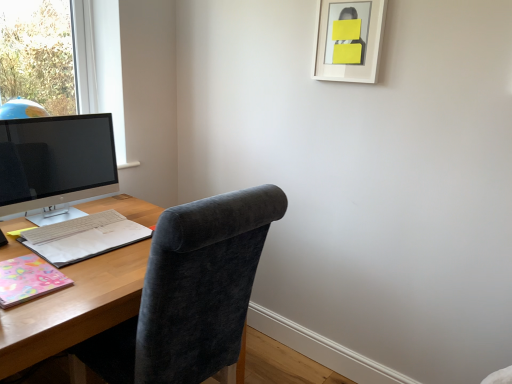
Measure the distance between point (260, 224) and camera.

The distance of point (260, 224) from camera is 1.27 meters.

Describe the element at coordinates (190, 292) in the screenshot. This screenshot has width=512, height=384. I see `dark gray fabric chair at center` at that location.

Locate an element on the screen. white matte keyboard at lower left is located at coordinates (71, 227).

What do you see at coordinates (74, 308) in the screenshot? This screenshot has width=512, height=384. I see `wooden desk at center` at bounding box center [74, 308].

How much space does multicolored paper notebook at left, acting as the first notebook starting from the back, occupy horizontally?

multicolored paper notebook at left, acting as the first notebook starting from the back, is 14.45 inches in width.

Image resolution: width=512 pixels, height=384 pixels. What do you see at coordinates (55, 161) in the screenshot?
I see `satin black monitor at left` at bounding box center [55, 161].

This screenshot has width=512, height=384. What do you see at coordinates (28, 280) in the screenshot?
I see `pastel floral paper at lower left, the first notebook from the front` at bounding box center [28, 280].

Where is `dark gray fabric chair at center`? The height and width of the screenshot is (384, 512). dark gray fabric chair at center is located at coordinates (190, 292).

From a real-world perspective, between pastel floral paper at lower left, which is the 2th notebook from back to front, and white matte keyboard at lower left, who is vertically higher?

white matte keyboard at lower left.

Looking at this image, considering the sizes of objects pastel floral paper at lower left, the first notebook from the front, and white matte keyboard at lower left in the image provided, who is bigger, pastel floral paper at lower left, the first notebook from the front, or white matte keyboard at lower left?

white matte keyboard at lower left is bigger.

Is white matte keyboard at lower left inside pastel floral paper at lower left, the first notebook from the front?

Actually, white matte keyboard at lower left is outside pastel floral paper at lower left, the first notebook from the front.

Is pastel floral paper at lower left, the first notebook from the front, not near white matte keyboard at lower left?

That's not correct — pastel floral paper at lower left, the first notebook from the front, is a little close to white matte keyboard at lower left.

Based on the photo, in terms of size, does wooden desk at center appear bigger or smaller than pastel floral paper at lower left, the first notebook from the front?

Clearly, wooden desk at center is larger in size than pastel floral paper at lower left, the first notebook from the front.

From a real-world perspective, is wooden desk at center physically above pastel floral paper at lower left, the first notebook from the front?

No, from a real-world perspective, wooden desk at center is not over pastel floral paper at lower left, the first notebook from the front

Is wooden desk at center with pastel floral paper at lower left, which is the 2th notebook from back to front?

No, wooden desk at center is not with pastel floral paper at lower left, which is the 2th notebook from back to front.

Is wooden desk at center facing away from pastel floral paper at lower left, the first notebook from the front?

No, wooden desk at center's orientation is not away from pastel floral paper at lower left, the first notebook from the front.

Which of these two, dark gray fabric chair at center or white matte keyboard at lower left, is bigger?

With larger size is dark gray fabric chair at center.

Is dark gray fabric chair at center oriented towards white matte keyboard at lower left?

Yes, dark gray fabric chair at center is oriented towards white matte keyboard at lower left.

From the image's perspective, between dark gray fabric chair at center and white matte keyboard at lower left, who is located below?

dark gray fabric chair at center.

From a real-world perspective, is white matte keyboard at lower left under pastel floral paper at lower left, the first notebook from the front?

Incorrect, from a real-world perspective, white matte keyboard at lower left is higher than pastel floral paper at lower left, the first notebook from the front.

From the image's perspective, does white matte keyboard at lower left appear lower than pastel floral paper at lower left, which is the 2th notebook from back to front?

No, from the image's perspective, white matte keyboard at lower left is not beneath pastel floral paper at lower left, which is the 2th notebook from back to front.

Is white matte keyboard at lower left outside of pastel floral paper at lower left, the first notebook from the front?

white matte keyboard at lower left lies outside pastel floral paper at lower left, the first notebook from the front,'s area.

In the scene shown: Is white matte keyboard at lower left taller or shorter than pastel floral paper at lower left, which is the 2th notebook from back to front?

Considering their sizes, white matte keyboard at lower left has more height than pastel floral paper at lower left, which is the 2th notebook from back to front.

Is dark gray fabric chair at center positioned beyond the bounds of satin black monitor at left?

dark gray fabric chair at center is positioned outside satin black monitor at left.

Relative to satin black monitor at left, is dark gray fabric chair at center in front or behind?

In the image, dark gray fabric chair at center appears in front of satin black monitor at left.

Can you see dark gray fabric chair at center touching satin black monitor at left?

dark gray fabric chair at center is not next to satin black monitor at left, and they're not touching.

From the image's perspective, is wooden desk at center above or below dark gray fabric chair at center?

Clearly, from the image's perspective, wooden desk at center is below dark gray fabric chair at center.

Considering the relative sizes of wooden desk at center and dark gray fabric chair at center in the image provided, is wooden desk at center shorter than dark gray fabric chair at center?

Yes, wooden desk at center is shorter than dark gray fabric chair at center.

From the picture: Could you tell me if wooden desk at center is turned towards dark gray fabric chair at center?

Yes, wooden desk at center faces towards dark gray fabric chair at center.

Based on the photo, considering the relative sizes of multicolored paper notebook at left, acting as the first notebook starting from the back, and wooden desk at center in the image provided, is multicolored paper notebook at left, acting as the first notebook starting from the back, thinner than wooden desk at center?

Indeed, multicolored paper notebook at left, acting as the first notebook starting from the back, has a lesser width compared to wooden desk at center.

From a real-world perspective, is multicolored paper notebook at left, acting as the second notebook starting from the front, on top of wooden desk at center?

Yes, from a real-world perspective, multicolored paper notebook at left, acting as the second notebook starting from the front, is over wooden desk at center

Consider the image. Between multicolored paper notebook at left, acting as the first notebook starting from the back, and wooden desk at center, which one has less height?

multicolored paper notebook at left, acting as the first notebook starting from the back, is shorter.

Can you tell me how much multicolored paper notebook at left, acting as the first notebook starting from the back, and wooden desk at center differ in facing direction?

0.679 degrees.

From the image's perspective, which notebook is the 2nd one below the white matte keyboard at lower left? Please provide its 2D coordinates.

[(28, 280)]

At what (x,y) coordinates should I click in order to perform the action: click on notebook that is on the left side of wooden desk at center. Please return your answer as a coordinate pair (x, y). The width and height of the screenshot is (512, 384). Looking at the image, I should click on [28, 280].

Considering their positions, is white matte picture frame at upper right positioned closer to dark gray fabric chair at center than pastel floral paper at lower left, which is the 2th notebook from back to front?

pastel floral paper at lower left, which is the 2th notebook from back to front.

Estimate the real-world distances between objects in this image. Which object is further from white matte picture frame at upper right, wooden desk at center or multicolored paper notebook at left, acting as the first notebook starting from the back?

The object further to white matte picture frame at upper right is wooden desk at center.

Estimate the real-world distances between objects in this image. Which object is further from wooden desk at center, pastel floral paper at lower left, which is the 2th notebook from back to front, or multicolored paper notebook at left, acting as the first notebook starting from the back?

Among the two, pastel floral paper at lower left, which is the 2th notebook from back to front, is located further to wooden desk at center.

Considering their positions, is multicolored paper notebook at left, acting as the first notebook starting from the back, positioned further to dark gray fabric chair at center than white matte picture frame at upper right?

white matte picture frame at upper right is positioned further to the anchor dark gray fabric chair at center.

Which object lies nearer to the anchor point dark gray fabric chair at center, white matte keyboard at lower left or white matte picture frame at upper right?

white matte keyboard at lower left.

Looking at the image, which one is located closer to white matte keyboard at lower left, multicolored paper notebook at left, acting as the second notebook starting from the front, or satin black monitor at left?

Based on the image, multicolored paper notebook at left, acting as the second notebook starting from the front, appears to be nearer to white matte keyboard at lower left.

When comparing their distances from wooden desk at center, does dark gray fabric chair at center or white matte picture frame at upper right seem further?

Among the two, white matte picture frame at upper right is located further to wooden desk at center.

Estimate the real-world distances between objects in this image. Which object is closer to satin black monitor at left, wooden desk at center or pastel floral paper at lower left, which is the 2th notebook from back to front?

Among the two, wooden desk at center is located nearer to satin black monitor at left.

Find the location of a particular element. computer keyboard between white matte picture frame at upper right and dark gray fabric chair at center from top to bottom is located at coordinates (71, 227).

In order to click on notebook between satin black monitor at left and pastel floral paper at lower left, which is the 2th notebook from back to front, from top to bottom in this screenshot , I will do `click(83, 237)`.

Identify the location of computer monitor between dark gray fabric chair at center and white matte keyboard at lower left along the z-axis. (55, 161).

This screenshot has height=384, width=512. Identify the location of desk positioned between dark gray fabric chair at center and multicolored paper notebook at left, acting as the first notebook starting from the back, from near to far. pyautogui.click(x=74, y=308).